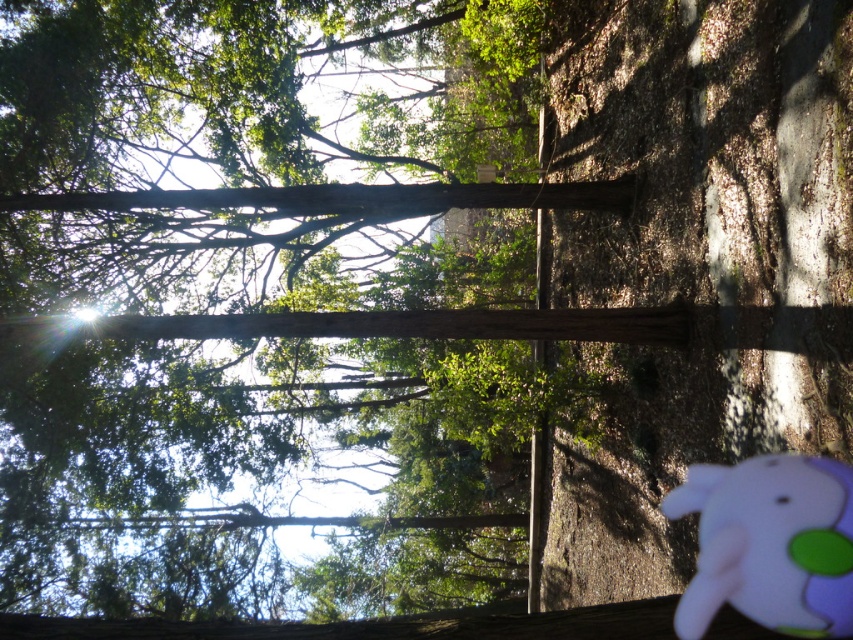
Question: Can you confirm if brown wood tree at center is thinner than pink fabric baby elephant at lower right?

Choices:
 (A) yes
 (B) no

Answer: (B)

Question: Which point is farther to the camera?

Choices:
 (A) pink fabric baby elephant at lower right
 (B) brown wood tree at center

Answer: (B)

Question: Can you confirm if brown wood tree at center is wider than pink fabric baby elephant at lower right?

Choices:
 (A) no
 (B) yes

Answer: (B)

Question: Is brown wood tree at center further to the viewer compared to pink fabric baby elephant at lower right?

Choices:
 (A) no
 (B) yes

Answer: (B)